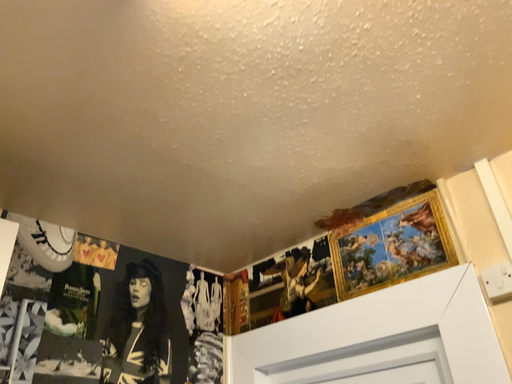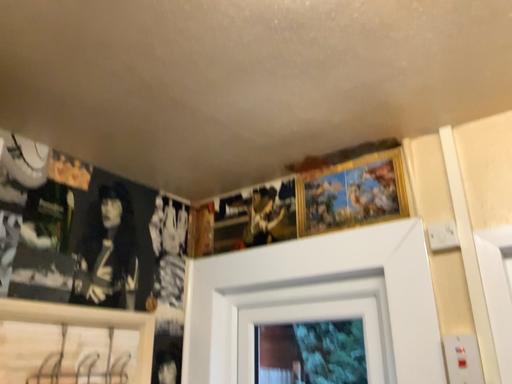
Question: Which way did the camera rotate in the video?

Choices:
 (A) rotated downward
 (B) rotated upward

Answer: (A)